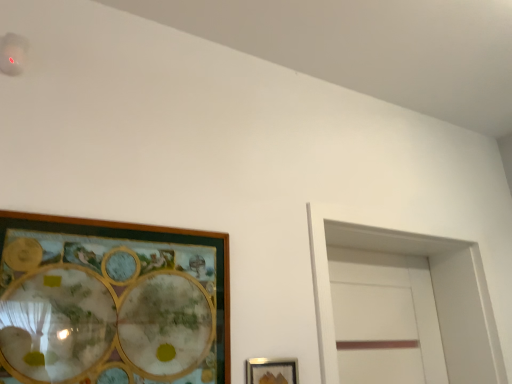
Question: Could you tell me if wooden picture frame at left, which is the first picture frame in top-to-bottom order, is facing metallic silver picture frame at lower center, the first picture frame positioned from the right?

Choices:
 (A) no
 (B) yes

Answer: (A)

Question: Does wooden picture frame at left, marked as the second picture frame in a right-to-left arrangement, have a greater height compared to metallic silver picture frame at lower center, the first picture frame positioned from the right?

Choices:
 (A) no
 (B) yes

Answer: (B)

Question: Is the position of wooden picture frame at left, which is the first picture frame in left-to-right order, less distant than that of metallic silver picture frame at lower center, positioned as the second picture frame in left-to-right order?

Choices:
 (A) yes
 (B) no

Answer: (A)

Question: Considering the relative sizes of wooden picture frame at left, marked as the second picture frame in a right-to-left arrangement, and metallic silver picture frame at lower center, positioned as the second picture frame in left-to-right order, in the image provided, is wooden picture frame at left, marked as the second picture frame in a right-to-left arrangement, wider than metallic silver picture frame at lower center, positioned as the second picture frame in left-to-right order,?

Choices:
 (A) no
 (B) yes

Answer: (B)

Question: Considering the relative positions of wooden picture frame at left, which is the first picture frame in left-to-right order, and metallic silver picture frame at lower center, the first picture frame positioned from the right, in the image provided, is wooden picture frame at left, which is the first picture frame in left-to-right order, to the right of metallic silver picture frame at lower center, the first picture frame positioned from the right, from the viewer's perspective?

Choices:
 (A) no
 (B) yes

Answer: (A)

Question: From a real-world perspective, is wooden picture frame at left, the second picture frame when ordered from bottom to top, located higher than metallic silver picture frame at lower center, positioned as the second picture frame in left-to-right order?

Choices:
 (A) no
 (B) yes

Answer: (B)

Question: From a real-world perspective, is metallic silver picture frame at lower center, the first picture frame ordered from the bottom, physically above wooden picture frame at left, which is the first picture frame in top-to-bottom order?

Choices:
 (A) yes
 (B) no

Answer: (B)

Question: Could you tell me if metallic silver picture frame at lower center, the first picture frame positioned from the right, is facing wooden picture frame at left, which is the first picture frame in top-to-bottom order?

Choices:
 (A) yes
 (B) no

Answer: (B)

Question: Is metallic silver picture frame at lower center, the 2th picture frame from the top, to the left of wooden picture frame at left, which is the first picture frame in top-to-bottom order, from the viewer's perspective?

Choices:
 (A) yes
 (B) no

Answer: (B)

Question: Would you say metallic silver picture frame at lower center, positioned as the second picture frame in left-to-right order, is a long distance from wooden picture frame at left, which is the first picture frame in left-to-right order?

Choices:
 (A) no
 (B) yes

Answer: (A)

Question: Is metallic silver picture frame at lower center, the 2th picture frame from the top, smaller than wooden picture frame at left, which is the first picture frame in left-to-right order?

Choices:
 (A) yes
 (B) no

Answer: (A)

Question: Does metallic silver picture frame at lower center, the 2th picture frame from the top, contain wooden picture frame at left, the second picture frame when ordered from bottom to top?

Choices:
 (A) no
 (B) yes

Answer: (A)

Question: Is white matte glass door at right to the right of wooden picture frame at left, the second picture frame when ordered from bottom to top, from the viewer's perspective?

Choices:
 (A) yes
 (B) no

Answer: (A)